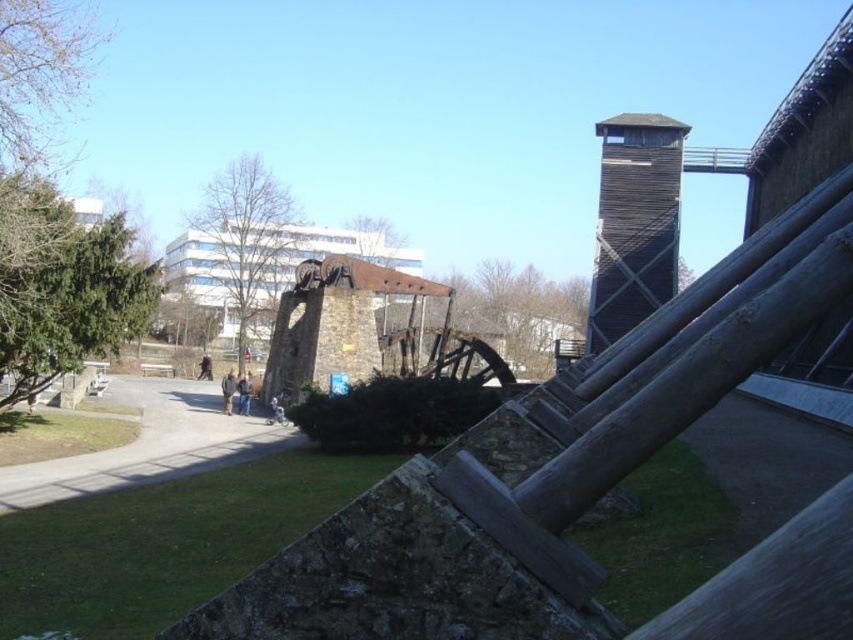
Between point (141, 618) and point (625, 614), which one is positioned behind?

Positioned behind is point (141, 618).

Does green grass at lower left have a lesser height compared to green grass at lower right?

No.

Is point (267, 522) positioned behind point (700, 460)?

That is True.

Find the location of a particular element. This screenshot has height=640, width=853. green grass at lower left is located at coordinates (164, 541).

Is green grass at lower left thinner than gray concrete path at center?

Correct, green grass at lower left's width is less than gray concrete path at center's.

Which of these two, green grass at lower left or gray concrete path at center, stands taller?

green grass at lower left

Does point (368, 461) come behind point (161, 419)?

No, it is not.

At what (x,y) coordinates should I click in order to perform the action: click on green grass at lower left. Please return your answer as a coordinate pair (x, y). The width and height of the screenshot is (853, 640). Looking at the image, I should click on (164, 541).

Is point (630, 540) positioned before point (187, 410)?

That is True.

From the picture: Who is lower down, green grass at lower right or gray concrete path at center?

gray concrete path at center is below.

Which is behind, point (613, 552) or point (209, 404)?

The point (209, 404) is more distant.

Where is `green grass at lower right`? Image resolution: width=853 pixels, height=640 pixels. green grass at lower right is located at coordinates (659, 534).